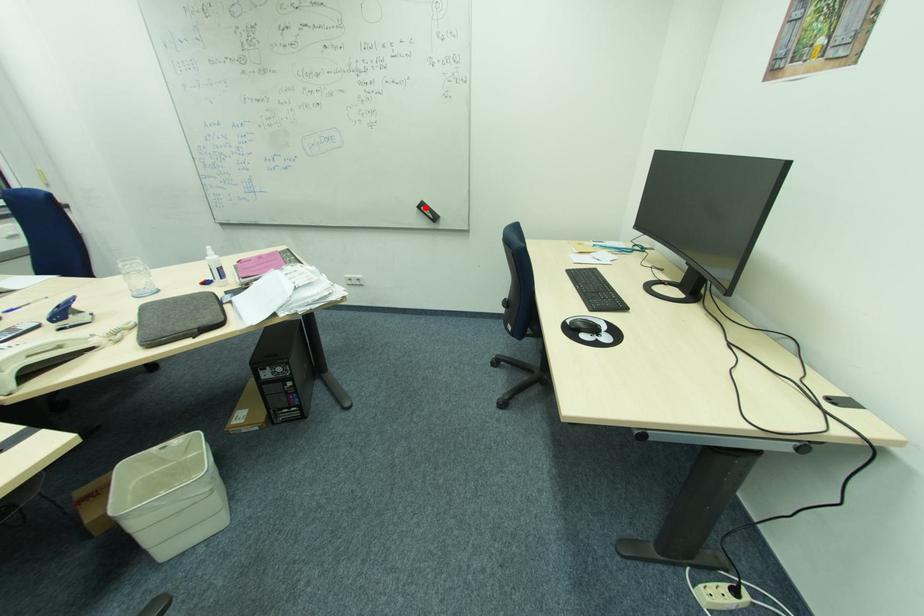
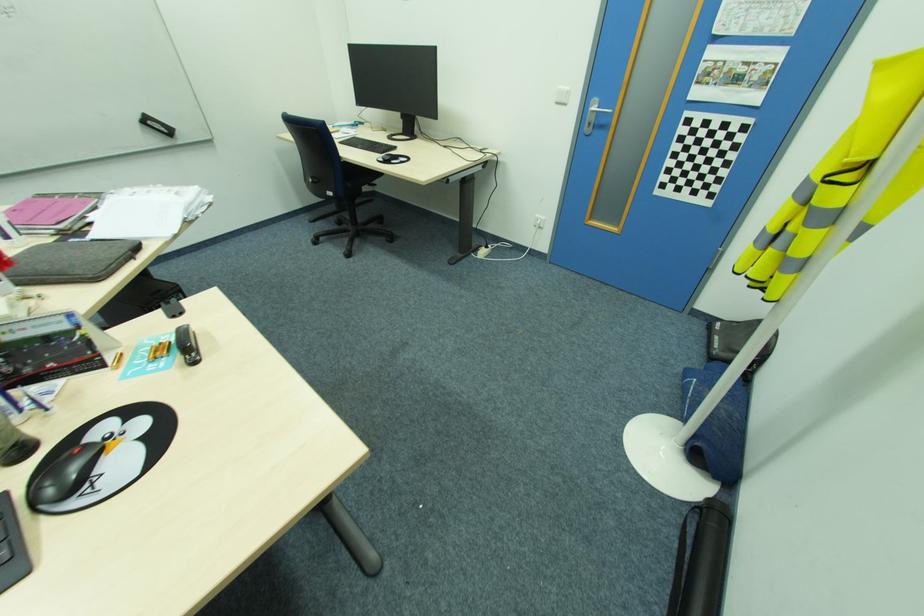
Find the pixel in the second image that matches the highlighted location in the first image.

(151, 123)